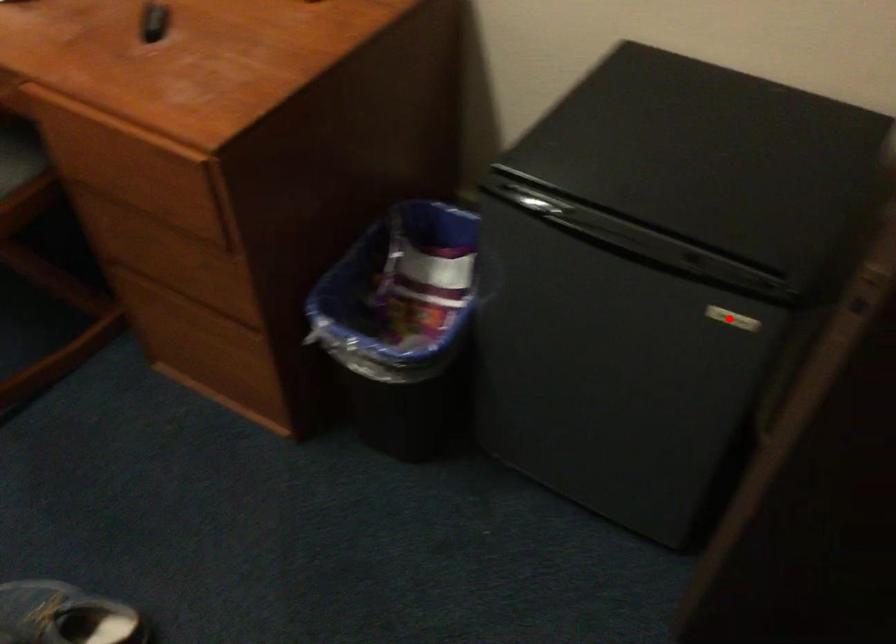
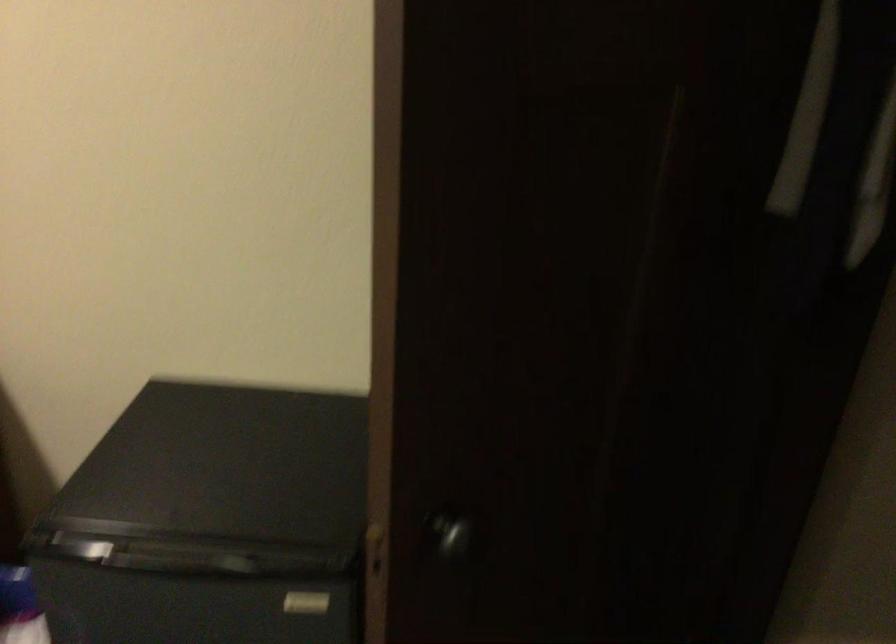
Locate, in the second image, the point that corresponds to the highlighted location in the first image.

(306, 603)